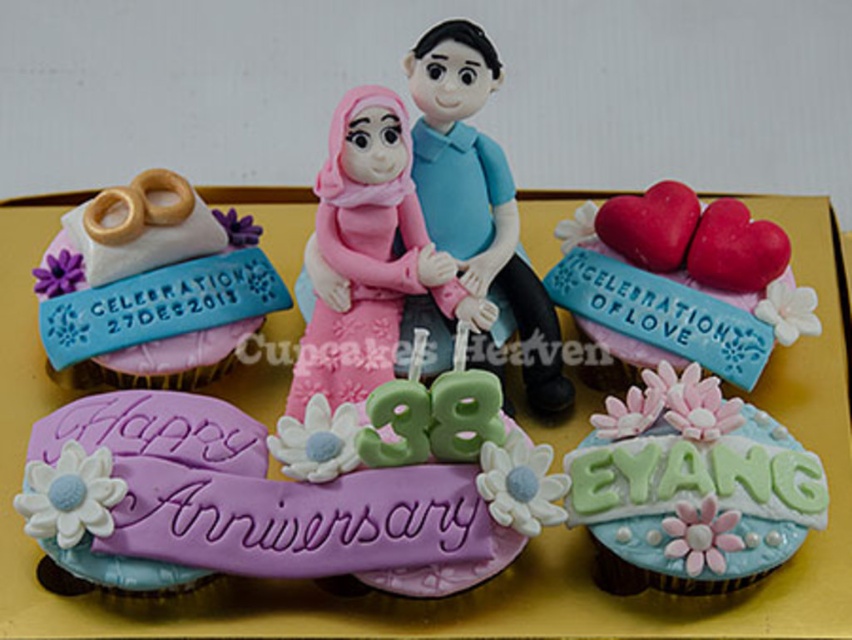
You are a guest at the anniversary celebration and want to take a photo of the cake and cupcakes. You notice two points marked on the display. The first point is at coordinate point(784, 480) and the second is at point(85, 212). If you want to ensure both points are visible in your photo without moving your camera, which point should you focus on to frame the scene properly?

You should focus on point(85, 212) because point(784, 480) is in front of it. By focusing on the point further back, you can ensure both the foreground and background elements are in frame without moving the camera.

You are a guest at the anniversary party and want to take a photo of both the pastel blue fondant cupcake with floral decorations at lower right and the matte pink fabric doll at center. Which object should you focus on first to ensure both are in the frame?

You should focus on the matte pink fabric doll at center first because it is farther away from the viewer than the pastel blue fondant cupcake with floral decorations at lower right. By focusing on the farther object, both will be in focus.

You are a guest at the anniversary celebration and want to take a photo of the pastel blue fondant cupcake with floral decorations at lower right and the white fondant rings at upper left. If you want to ensure both are fully visible in your photo, which object should you focus on first?

The white fondant rings at upper left are taller than the pastel blue fondant cupcake with floral decorations at lower right. To ensure both are fully visible, focus on the white fondant rings at upper left first to capture their full height, then adjust the angle to include the cupcake.